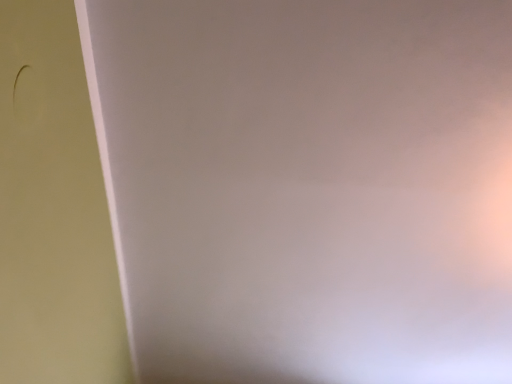
At what (x,y) coordinates should I click in order to perform the action: click on white matte trim at left. Please return your answer as a coordinate pair (x, y). This screenshot has width=512, height=384. Looking at the image, I should click on (53, 210).

Measure the distance between white matte trim at left and camera.

The distance of white matte trim at left from camera is 19.84 inches.

This screenshot has width=512, height=384. Describe the element at coordinates (53, 210) in the screenshot. I see `white matte trim at left` at that location.

Locate an element on the screen. This screenshot has width=512, height=384. white matte trim at left is located at coordinates click(x=53, y=210).